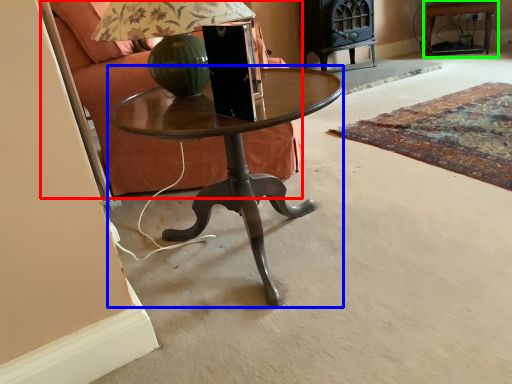
Question: Which is farther away from armchair (highlighted by a red box)? coffee table (highlighted by a blue box) or side table (highlighted by a green box)?

Choices:
 (A) coffee table
 (B) side table

Answer: (B)